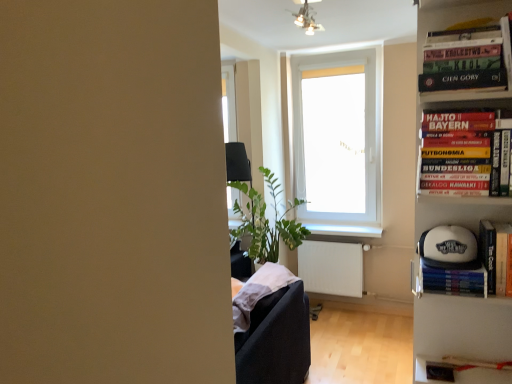
The width and height of the screenshot is (512, 384). I want to click on free space above hardcover book at right, which appears as the 2th book when ordered from the bottom (from a real-world perspective), so click(472, 110).